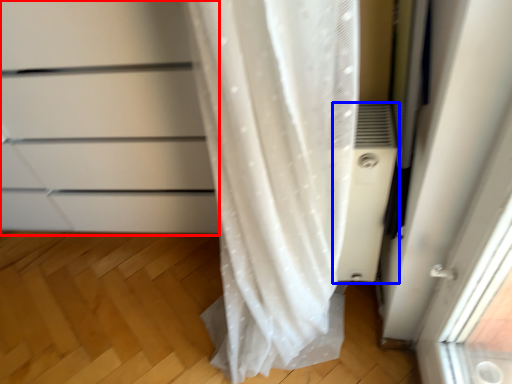
Question: Which object appears farthest to the camera in this image, cabinetry (highlighted by a red box) or air conditioner (highlighted by a blue box)?

Choices:
 (A) cabinetry
 (B) air conditioner

Answer: (B)